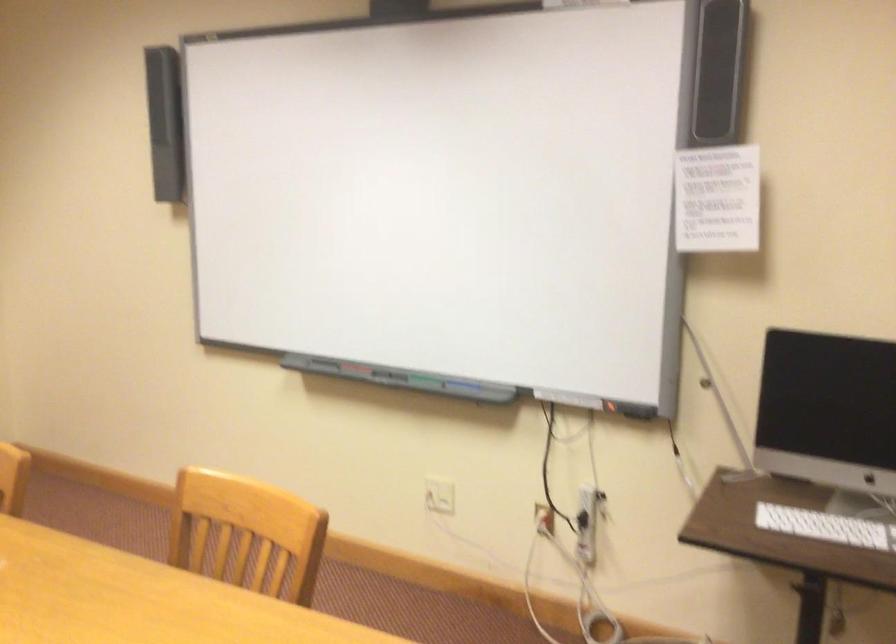
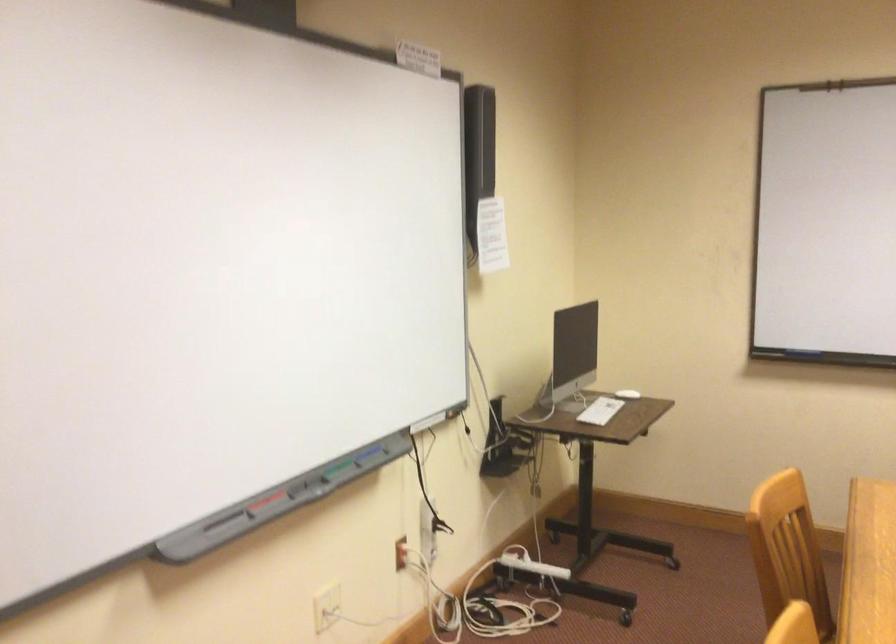
Question: I am providing you with two images of the same scene from different viewpoints. Which of the following objects are not visible in image2?

Choices:
 (A) green whiteboard marker
 (B) white power strip
 (C) red whiteboard marker
 (D) none of these

Answer: (D)